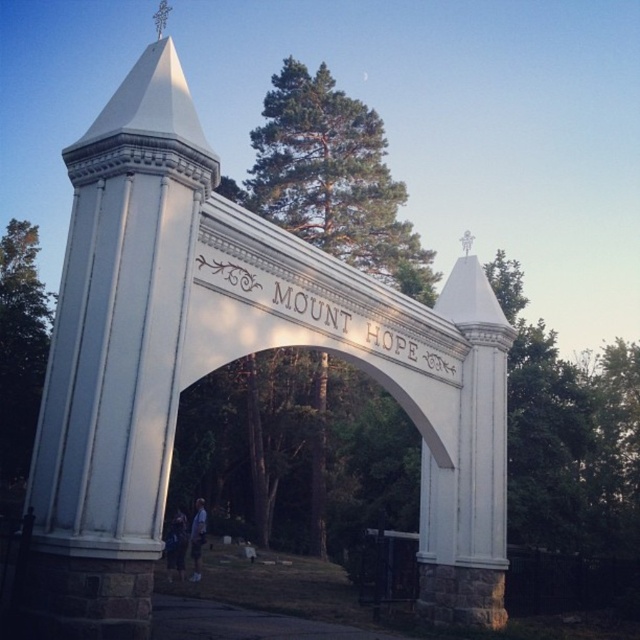
Question: Among these objects, which one is nearest to the camera?

Choices:
 (A) green leafy tree at left
 (B) dark blue jeans at lower center
 (C) light blue jeans at center

Answer: (C)

Question: Among these objects, which one is nearest to the camera?

Choices:
 (A) green leafy tree at center
 (B) green leafy tree at left

Answer: (A)

Question: Which point is farther from the camera taking this photo?

Choices:
 (A) (310, 99)
 (B) (204, 525)
 (C) (40, 369)

Answer: (C)

Question: In this image, where is white stone pillar at left located relative to light blue jeans at center?

Choices:
 (A) below
 (B) above

Answer: (B)

Question: Is green leafy tree at left to the left of light blue jeans at center from the viewer's perspective?

Choices:
 (A) no
 (B) yes

Answer: (B)

Question: Is white stone pillar at left positioned at the back of light blue jeans at center?

Choices:
 (A) yes
 (B) no

Answer: (B)